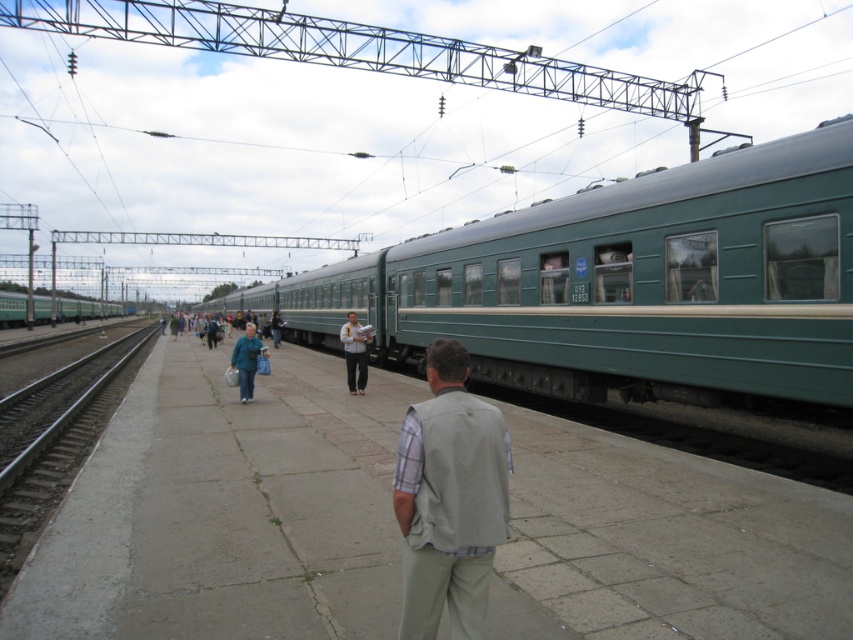
Question: Which point is farther to the camera?

Choices:
 (A) (210, 330)
 (B) (361, 365)

Answer: (A)

Question: Does teal fabric jacket at center have a greater width compared to blue denim jacket at center?

Choices:
 (A) no
 (B) yes

Answer: (A)

Question: Does green matte train at left come in front of blue denim jacket at center?

Choices:
 (A) yes
 (B) no

Answer: (B)

Question: Which object is farther from the camera taking this photo?

Choices:
 (A) beige fabric vest at center
 (B) light blue jeans at center
 (C) blue denim jacket at center

Answer: (B)

Question: Considering the relative positions of gray concrete train track at lower left and teal fabric jacket at center in the image provided, where is gray concrete train track at lower left located with respect to teal fabric jacket at center?

Choices:
 (A) right
 (B) left

Answer: (A)

Question: Which point is closer to the camera?

Choices:
 (A) (20, 321)
 (B) (114, 570)
 (C) (241, 349)

Answer: (B)